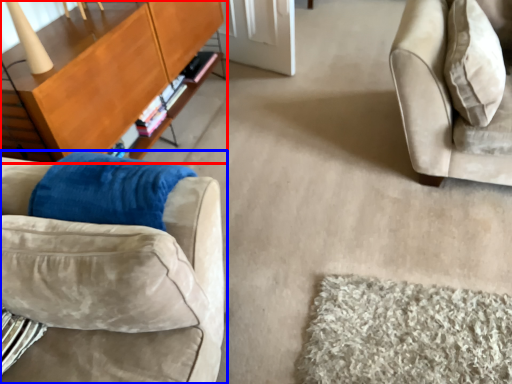
Question: Among these objects, which one is nearest to the camera, table (highlighted by a red box) or studio couch (highlighted by a blue box)?

Choices:
 (A) table
 (B) studio couch

Answer: (B)